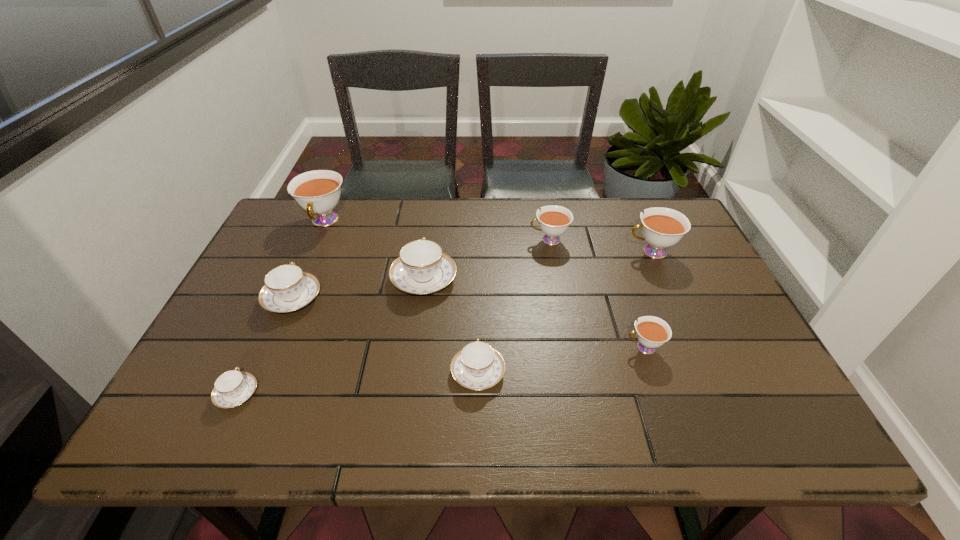
Where is `the closest white teacup to the biggest blue teacup`? the closest white teacup to the biggest blue teacup is located at coordinates (318, 192).

This screenshot has width=960, height=540. Find the location of `blue teacup that is the third closest to the second tallest teacup`. blue teacup that is the third closest to the second tallest teacup is located at coordinates (287, 288).

Select which blue teacup appears as the closest to the second tallest object. Please provide its 2D coordinates. Your answer should be formatted as a tuple, i.e. [(x, y)], where the tuple contains the x and y coordinates of a point satisfying the conditions above.

[(477, 366)]